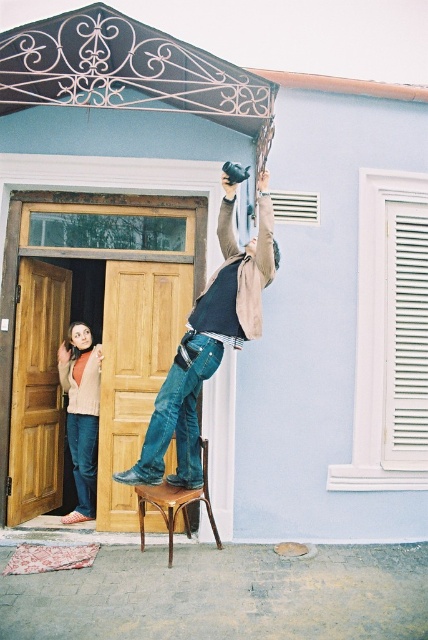
Question: Which object is positioned closest to the brown wooden chair at center?

Choices:
 (A) denim jeans at center
 (B) denim jeans at left

Answer: (A)

Question: In this image, where is black wrought iron canopy at upper center located relative to denim jeans at left?

Choices:
 (A) right
 (B) left

Answer: (A)

Question: Can you confirm if black wrought iron canopy at upper center is wider than denim jeans at left?

Choices:
 (A) yes
 (B) no

Answer: (A)

Question: In this image, where is denim jeans at left located relative to brown wooden chair at center?

Choices:
 (A) above
 (B) below

Answer: (A)

Question: Which object appears farthest from the camera in this image?

Choices:
 (A) denim jeans at center
 (B) denim jeans at left
 (C) black wrought iron canopy at upper center
 (D) brown wooden chair at center

Answer: (B)

Question: Considering the real-world distances, which object is closest to the black wrought iron canopy at upper center?

Choices:
 (A) denim jeans at center
 (B) denim jeans at left

Answer: (A)